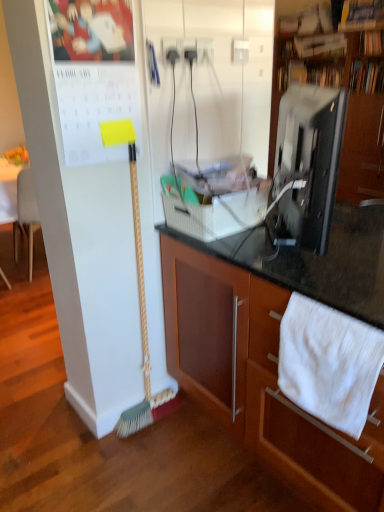
Question: Is the position of wooden cabinet at center, which ranks as the 1th cabinetry in front-to-back order, less distant than that of green bristle broom at left?

Choices:
 (A) yes
 (B) no

Answer: (A)

Question: Is wooden cabinet at center, acting as the second cabinetry starting from the top, looking in the opposite direction of green bristle broom at left?

Choices:
 (A) yes
 (B) no

Answer: (B)

Question: From the image's perspective, is wooden cabinet at center, the 2th cabinetry in the back-to-front sequence, located above green bristle broom at left?

Choices:
 (A) yes
 (B) no

Answer: (B)

Question: Is wooden cabinet at center, which is the 1th cabinetry from bottom to top, shorter than green bristle broom at left?

Choices:
 (A) yes
 (B) no

Answer: (A)

Question: Is wooden cabinet at center, which ranks as the 1th cabinetry in front-to-back order, not near green bristle broom at left?

Choices:
 (A) no
 (B) yes

Answer: (A)

Question: Is wooden cabinet at center, the 2th cabinetry in the back-to-front sequence, wider than green bristle broom at left?

Choices:
 (A) yes
 (B) no

Answer: (A)

Question: Is green bristle broom at left smaller than white cotton towel at lower right?

Choices:
 (A) yes
 (B) no

Answer: (B)

Question: From the image's perspective, is green bristle broom at left below white cotton towel at lower right?

Choices:
 (A) no
 (B) yes

Answer: (A)

Question: Considering the relative sizes of green bristle broom at left and white cotton towel at lower right in the image provided, is green bristle broom at left shorter than white cotton towel at lower right?

Choices:
 (A) no
 (B) yes

Answer: (A)

Question: Is the depth of green bristle broom at left less than that of white cotton towel at lower right?

Choices:
 (A) no
 (B) yes

Answer: (A)

Question: Is green bristle broom at left located outside white cotton towel at lower right?

Choices:
 (A) yes
 (B) no

Answer: (A)

Question: Is green bristle broom at left at the right side of white cotton towel at lower right?

Choices:
 (A) yes
 (B) no

Answer: (B)

Question: Considering the relative sizes of green bristle broom at left and black glossy monitor at upper right in the image provided, is green bristle broom at left taller than black glossy monitor at upper right?

Choices:
 (A) yes
 (B) no

Answer: (A)